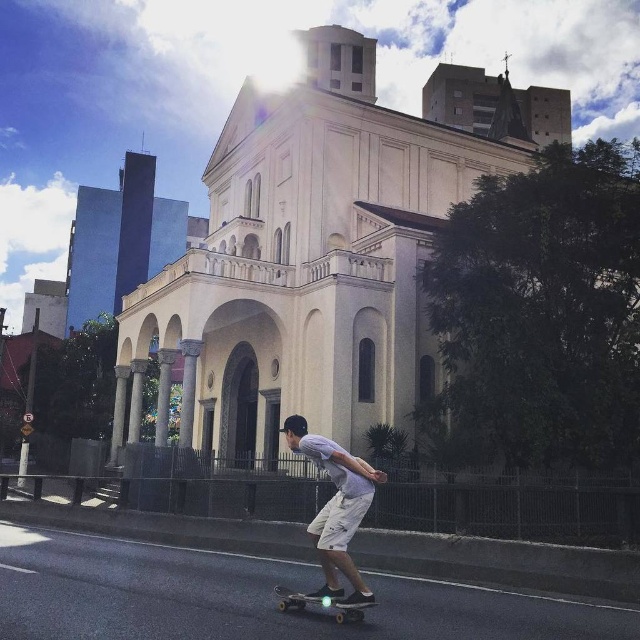
Question: Can you confirm if light gray cotton t-shirt at center is bigger than metallic silver skateboard at lower center?

Choices:
 (A) yes
 (B) no

Answer: (A)

Question: Among these objects, which one is farthest from the camera?

Choices:
 (A) light gray cotton t-shirt at center
 (B) metallic silver skateboard at lower center

Answer: (A)

Question: Can you confirm if light gray cotton t-shirt at center is positioned to the right of metallic silver skateboard at lower center?

Choices:
 (A) no
 (B) yes

Answer: (A)

Question: Which of the following is the closest to the observer?

Choices:
 (A) (355, 588)
 (B) (348, 598)

Answer: (B)

Question: In this image, where is light gray cotton t-shirt at center located relative to metallic silver skateboard at lower center?

Choices:
 (A) below
 (B) above

Answer: (B)